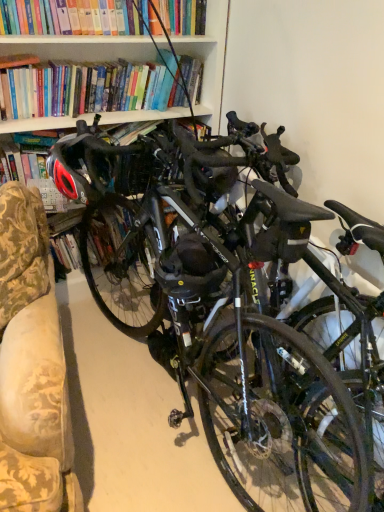
Question: Can you confirm if shiny black bicycle at center is thinner than shiny black helmet at left?

Choices:
 (A) no
 (B) yes

Answer: (A)

Question: From a real-world perspective, is shiny black bicycle at center physically above shiny black helmet at left?

Choices:
 (A) yes
 (B) no

Answer: (B)

Question: Is shiny black bicycle at center positioned with its back to shiny black helmet at left?

Choices:
 (A) yes
 (B) no

Answer: (A)

Question: From a real-world perspective, is shiny black bicycle at center beneath shiny black helmet at left?

Choices:
 (A) no
 (B) yes

Answer: (B)

Question: Is shiny black bicycle at center completely or partially outside of shiny black helmet at left?

Choices:
 (A) no
 (B) yes

Answer: (B)

Question: Is shiny black bicycle at center oriented towards shiny black helmet at left?

Choices:
 (A) no
 (B) yes

Answer: (B)

Question: Could shiny black bicycle at center be considered to be inside matte black helmet at center?

Choices:
 (A) no
 (B) yes

Answer: (A)

Question: Is matte black helmet at center located outside shiny black bicycle at center?

Choices:
 (A) no
 (B) yes

Answer: (A)

Question: Does matte black helmet at center turn towards shiny black bicycle at center?

Choices:
 (A) yes
 (B) no

Answer: (A)

Question: Is matte black helmet at center next to shiny black bicycle at center and touching it?

Choices:
 (A) yes
 (B) no

Answer: (B)

Question: From a real-world perspective, is matte black helmet at center on shiny black bicycle at center?

Choices:
 (A) no
 (B) yes

Answer: (B)

Question: Is matte black helmet at center smaller than shiny black bicycle at center?

Choices:
 (A) yes
 (B) no

Answer: (A)

Question: From the image's perspective, would you say shiny black helmet at left is positioned over shiny black bicycle at center?

Choices:
 (A) no
 (B) yes

Answer: (B)